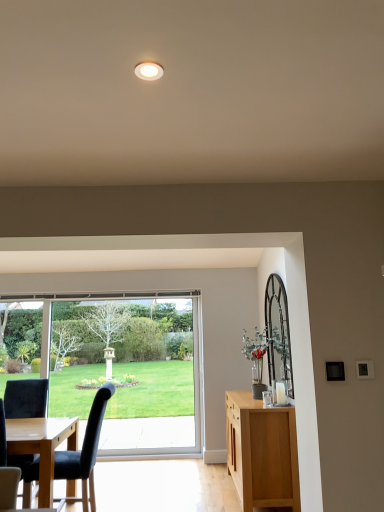
Question: Would you say black leather chair at lower left, placed as the second chair when sorted from right to left, is outside white glossy light fixture at upper center?

Choices:
 (A) yes
 (B) no

Answer: (A)

Question: Is black leather chair at lower left, placed as the second chair when sorted from right to left, facing towards white glossy light fixture at upper center?

Choices:
 (A) yes
 (B) no

Answer: (B)

Question: Is black leather chair at lower left, which ranks as the first chair in left-to-right order, wider than white glossy light fixture at upper center?

Choices:
 (A) yes
 (B) no

Answer: (A)

Question: From the image's perspective, is black leather chair at lower left, placed as the second chair when sorted from right to left, located above white glossy light fixture at upper center?

Choices:
 (A) no
 (B) yes

Answer: (A)

Question: Considering the relative sizes of black leather chair at lower left, placed as the second chair when sorted from right to left, and white glossy light fixture at upper center in the image provided, is black leather chair at lower left, placed as the second chair when sorted from right to left, taller than white glossy light fixture at upper center?

Choices:
 (A) no
 (B) yes

Answer: (B)

Question: Is black leather chair at lower left, which ranks as the first chair in left-to-right order, facing away from white glossy light fixture at upper center?

Choices:
 (A) no
 (B) yes

Answer: (A)

Question: Would you say black fabric chair at left, positioned as the second chair in left-to-right order, is part of white glossy light fixture at upper center's contents?

Choices:
 (A) yes
 (B) no

Answer: (B)

Question: Considering the relative sizes of white glossy light fixture at upper center and black fabric chair at left, which appears as the first chair when viewed from the right, in the image provided, is white glossy light fixture at upper center shorter than black fabric chair at left, which appears as the first chair when viewed from the right,?

Choices:
 (A) yes
 (B) no

Answer: (A)

Question: From a real-world perspective, is white glossy light fixture at upper center below black fabric chair at left, positioned as the second chair in left-to-right order?

Choices:
 (A) yes
 (B) no

Answer: (B)

Question: Is white glossy light fixture at upper center closer to the viewer compared to black fabric chair at left, positioned as the second chair in left-to-right order?

Choices:
 (A) no
 (B) yes

Answer: (B)

Question: Can you confirm if white glossy light fixture at upper center is taller than black fabric chair at left, positioned as the second chair in left-to-right order?

Choices:
 (A) yes
 (B) no

Answer: (B)

Question: From a real-world perspective, is white glossy light fixture at upper center physically above black fabric chair at left, positioned as the second chair in left-to-right order?

Choices:
 (A) no
 (B) yes

Answer: (B)

Question: Is clear glass window at center shorter than white glossy light fixture at upper center?

Choices:
 (A) no
 (B) yes

Answer: (A)